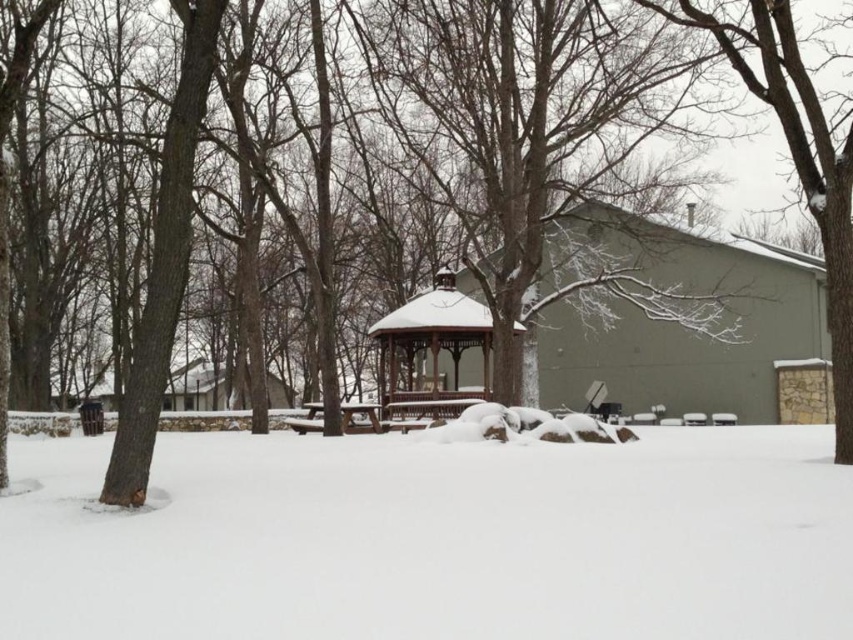
Does white fluffy snow at lower center have a greater height compared to brown wooden picnic table at center?

Incorrect, white fluffy snow at lower center's height is not larger of brown wooden picnic table at center's.

Can you confirm if white fluffy snow at lower center is positioned below brown wooden picnic table at center?

No, white fluffy snow at lower center is not below brown wooden picnic table at center.

Between point (73, 508) and point (370, 406), which one is positioned behind?

Point (370, 406)

Where is `white fluffy snow at lower center`? white fluffy snow at lower center is located at coordinates (434, 538).

Who is positioned more to the right, snow-covered tree at upper right or wooden gazebo at center?

snow-covered tree at upper right is more to the right.

Is point (793, 45) farther from camera compared to point (393, 344)?

No.

Is point (815, 96) less distant than point (448, 400)?

Yes, it is in front of point (448, 400).

Identify the location of snow-covered tree at upper right. (801, 170).

Is white fluffy snow at lower center in front of wooden gazebo at center?

Yes, it is in front of wooden gazebo at center.

Can you confirm if white fluffy snow at lower center is bigger than wooden gazebo at center?

No.

Which is behind, point (701, 544) or point (396, 401)?

Positioned behind is point (396, 401).

Where is `white fluffy snow at lower center`? The width and height of the screenshot is (853, 640). white fluffy snow at lower center is located at coordinates (434, 538).